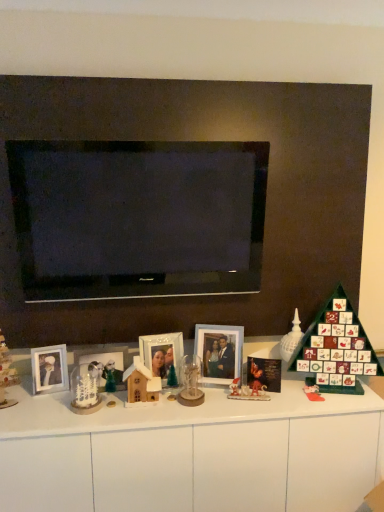
Where is `free space between clear glass candle holder at center, which is the 1th candle holder in right-to-left order, and matte plastic toy at right, arranged as the second toy when viewed from the back`? The width and height of the screenshot is (384, 512). free space between clear glass candle holder at center, which is the 1th candle holder in right-to-left order, and matte plastic toy at right, arranged as the second toy when viewed from the back is located at coordinates (253, 398).